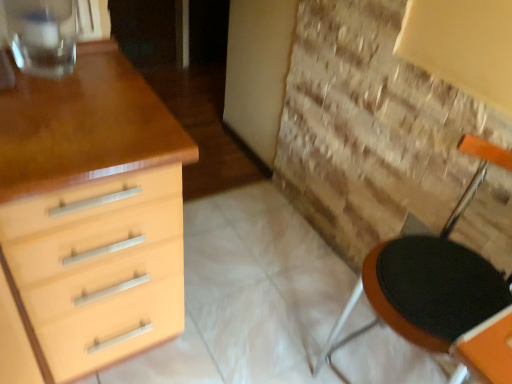
Describe the element at coordinates (42, 36) in the screenshot. I see `transparent glass at upper left` at that location.

The width and height of the screenshot is (512, 384). What do you see at coordinates (433, 276) in the screenshot?
I see `black fabric armchair at right` at bounding box center [433, 276].

Locate an element on the screen. This screenshot has height=384, width=512. transparent glass at upper left is located at coordinates (42, 36).

Consider the image. From the image's perspective, is matte wood chest of drawers at left on transparent glass at upper left?

Incorrect, from the image's perspective, matte wood chest of drawers at left is lower than transparent glass at upper left.

Considering the positions of objects matte wood chest of drawers at left and transparent glass at upper left in the image provided, who is behind, matte wood chest of drawers at left or transparent glass at upper left?

transparent glass at upper left is further from the camera.

How many degrees apart are the facing directions of matte wood chest of drawers at left and transparent glass at upper left?

1.19 degrees separate the facing orientations of matte wood chest of drawers at left and transparent glass at upper left.

You are a GUI agent. You are given a task and a screenshot of the screen. Output one action in this format:
    pyautogui.click(x=<x>, y=<y>)
    Task: Click on the armchair below the transparent glass at upper left (from the image's perspective)
    
    Given the screenshot: What is the action you would take?
    click(x=433, y=276)

Is transparent glass at upper left to the right of black fabric armchair at right from the viewer's perspective?

Incorrect, transparent glass at upper left is not on the right side of black fabric armchair at right.

Can you tell me how much transparent glass at upper left and black fabric armchair at right differ in facing direction?

82 degrees separate the facing orientations of transparent glass at upper left and black fabric armchair at right.

Can you see transparent glass at upper left touching black fabric armchair at right?

No, transparent glass at upper left is not beside black fabric armchair at right.

Is matte wood chest of drawers at left located outside black fabric armchair at right?

matte wood chest of drawers at left is positioned outside black fabric armchair at right.

In the scene shown: Can you tell me how much matte wood chest of drawers at left and black fabric armchair at right differ in facing direction?

The facing directions of matte wood chest of drawers at left and black fabric armchair at right are 83.2 degrees apart.

Consider the image. Considering the sizes of objects matte wood chest of drawers at left and black fabric armchair at right in the image provided, who is bigger, matte wood chest of drawers at left or black fabric armchair at right?

matte wood chest of drawers at left is bigger.

Is matte wood chest of drawers at left taller than black fabric armchair at right?

Yes, matte wood chest of drawers at left is taller than black fabric armchair at right.

Does black fabric armchair at right have a lesser height compared to transparent glass at upper left?

No, black fabric armchair at right is not shorter than transparent glass at upper left.

Would you say black fabric armchair at right contains transparent glass at upper left?

That's incorrect, transparent glass at upper left is not inside black fabric armchair at right.

From the image's perspective, is black fabric armchair at right located beneath transparent glass at upper left?

Yes.

Is black fabric armchair at right far from transparent glass at upper left?

Absolutely, black fabric armchair at right is distant from transparent glass at upper left.

Considering the relative positions of black fabric armchair at right and matte wood chest of drawers at left in the image provided, is black fabric armchair at right to the right of matte wood chest of drawers at left from the viewer's perspective?

Indeed, black fabric armchair at right is positioned on the right side of matte wood chest of drawers at left.

Considering the sizes of objects black fabric armchair at right and matte wood chest of drawers at left in the image provided, who is taller, black fabric armchair at right or matte wood chest of drawers at left?

Standing taller between the two is matte wood chest of drawers at left.

From the image's perspective, who appears lower, black fabric armchair at right or matte wood chest of drawers at left?

black fabric armchair at right, from the image's perspective.

Would you say black fabric armchair at right is outside matte wood chest of drawers at left?

Yes, black fabric armchair at right is outside of matte wood chest of drawers at left.

Does point (35, 21) appear closer or farther from the camera than point (115, 343)?

Point (35, 21) is positioned closer to the camera compared to point (115, 343).

Find the location of a particular element. the chest of drawers below the transparent glass at upper left (from a real-world perspective) is located at coordinates (97, 269).

Would you say transparent glass at upper left is outside matte wood chest of drawers at left?

Yes, transparent glass at upper left is not within matte wood chest of drawers at left.

Locate an element on the screen. The image size is (512, 384). glass vase on the right of matte wood chest of drawers at left is located at coordinates 42,36.

Locate an element on the screen. The image size is (512, 384). glass vase on the left of the black fabric armchair at right is located at coordinates (42, 36).

Looking at this image, which object lies nearer to the anchor point matte wood chest of drawers at left, black fabric armchair at right or transparent glass at upper left?

Based on the image, transparent glass at upper left appears to be nearer to matte wood chest of drawers at left.

Based on their spatial positions, is transparent glass at upper left or matte wood chest of drawers at left closer to black fabric armchair at right?

matte wood chest of drawers at left is positioned closer to the anchor black fabric armchair at right.

Based on their spatial positions, is transparent glass at upper left or black fabric armchair at right further from matte wood chest of drawers at left?

black fabric armchair at right.

Looking at the image, which one is located further to transparent glass at upper left, black fabric armchair at right or matte wood chest of drawers at left?

The object further to transparent glass at upper left is black fabric armchair at right.

Based on their spatial positions, is matte wood chest of drawers at left or black fabric armchair at right closer to transparent glass at upper left?

matte wood chest of drawers at left is closer to transparent glass at upper left.

Estimate the real-world distances between objects in this image. Which object is further from black fabric armchair at right, matte wood chest of drawers at left or transparent glass at upper left?

Based on the image, transparent glass at upper left appears to be further to black fabric armchair at right.

Identify the location of glass vase between matte wood chest of drawers at left and black fabric armchair at right in the horizontal direction. This screenshot has width=512, height=384. (42, 36).